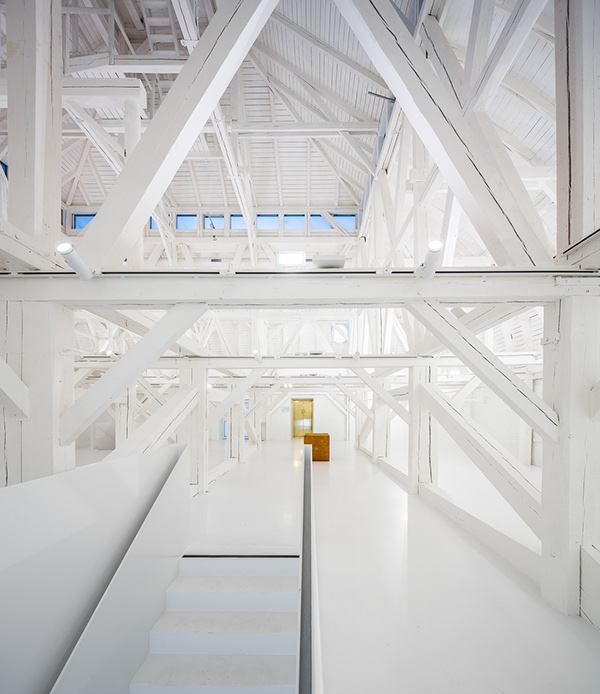
Identify the location of corner. (522, 348).